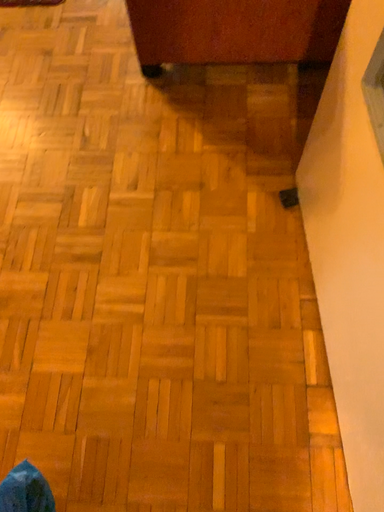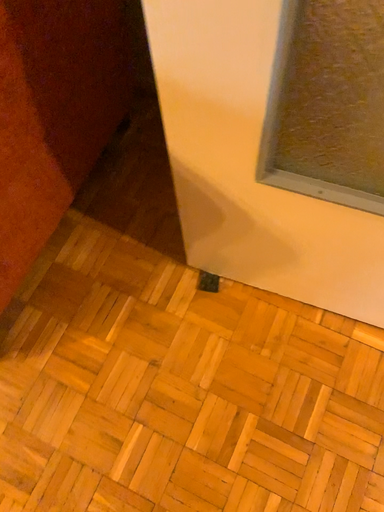
Question: Which way did the camera rotate in the video?

Choices:
 (A) rotated upward
 (B) rotated downward

Answer: (A)